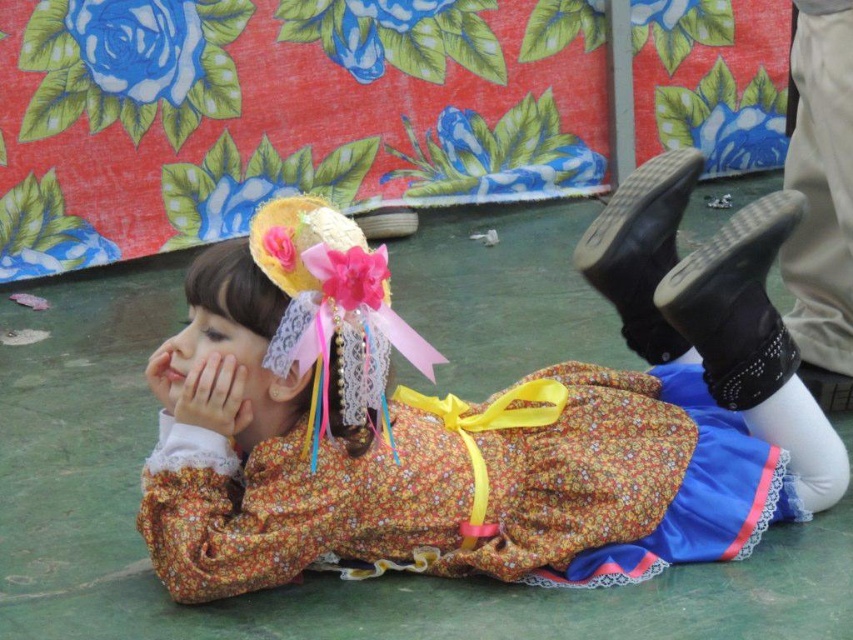
Can you confirm if smooth skin face at center is thinner than matte yellow hand at center?

Incorrect, smooth skin face at center's width is not less than matte yellow hand at center's.

From the picture: Between smooth skin face at center and matte yellow hand at center, which one has less height?

matte yellow hand at center

In order to click on smooth skin face at center in this screenshot , I will do `click(209, 356)`.

Is floral fabric dress at center behind smooth skin face at center?

No, it is not.

In the scene shown: Is floral fabric dress at center in front of smooth skin face at center?

Yes, floral fabric dress at center is closer to the viewer.

Identify the location of floral fabric dress at center. tap(497, 417).

Find the location of a particular element. floral fabric dress at center is located at coordinates (497, 417).

Is floral fabric dress at center positioned behind matte yellow hand at center?

No.

The width and height of the screenshot is (853, 640). In order to click on floral fabric dress at center in this screenshot , I will do `click(497, 417)`.